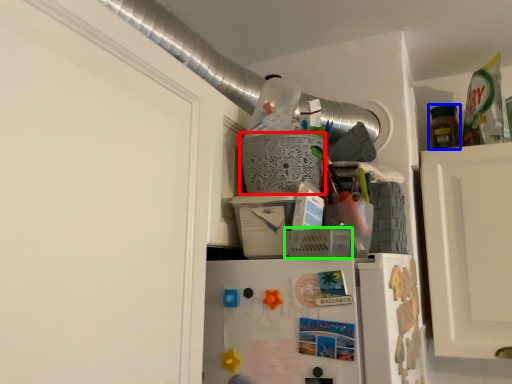
Question: Which object is the closest to the basket (highlighted by a red box)? Choose among these: bottle (highlighted by a blue box) or basket (highlighted by a green box).

Choices:
 (A) bottle
 (B) basket

Answer: (B)